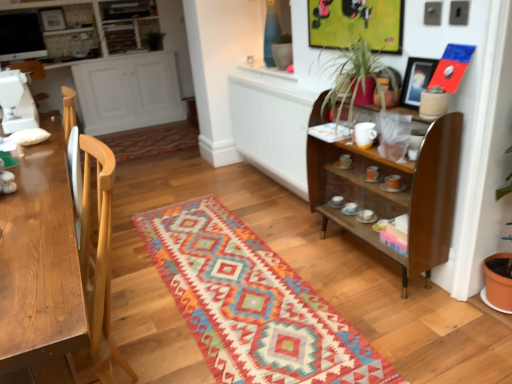
Question: Considering the relative positions of white wood cabinet at left, which ranks as the first cabinetry in bottom-to-top order, and green leafy plant at upper right in the image provided, is white wood cabinet at left, which ranks as the first cabinetry in bottom-to-top order, to the left or to the right of green leafy plant at upper right?

Choices:
 (A) right
 (B) left

Answer: (B)

Question: In terms of width, does white wood cabinet at left, which ranks as the first cabinetry in bottom-to-top order, look wider or thinner when compared to green leafy plant at upper right?

Choices:
 (A) wide
 (B) thin

Answer: (A)

Question: Which object is the farthest from the matte black picture frame at upper right?

Choices:
 (A) white glossy cabinet at upper left, the second cabinetry when ordered from bottom to top
 (B) green leafy plant at upper right
 (C) white wood cabinet at left, which is the second cabinetry in top-to-bottom order
 (D) glossy wood shelf at upper right
 (E) multicolored woven mat at center

Answer: (A)

Question: Estimate the real-world distances between objects in this image. Which object is closer to the green leafy plant at upper center?

Choices:
 (A) matte black picture frame at upper right
 (B) green leafy plant at upper right
 (C) white glossy cabinet at upper left, acting as the first cabinetry starting from the top
 (D) glossy wood shelf at upper right
 (E) multicolored woven mat at center

Answer: (C)